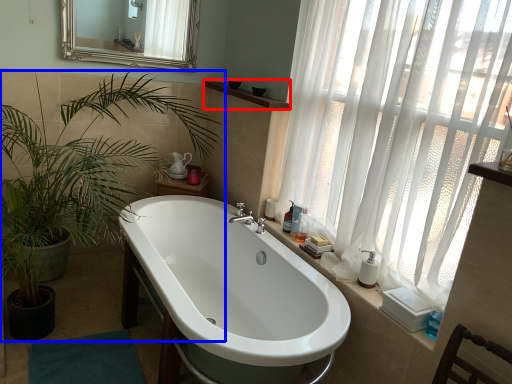
Question: Which of the following is the closest to the observer, balustrade (highlighted by a red box) or houseplant (highlighted by a blue box)?

Choices:
 (A) balustrade
 (B) houseplant

Answer: (B)